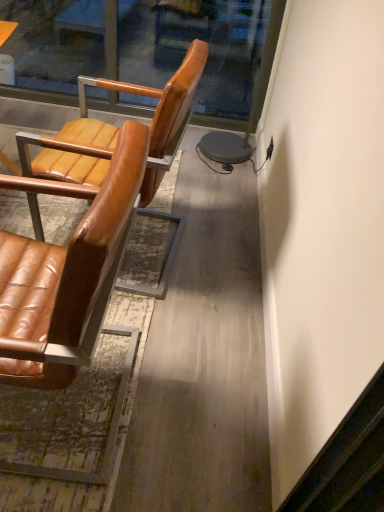
Question: Does brown leather chair at left, arranged as the 2th chair when viewed from the back, have a larger size compared to brown leather chair at left, which appears as the first chair when viewed from the back?

Choices:
 (A) no
 (B) yes

Answer: (B)

Question: Considering the relative sizes of brown leather chair at left, arranged as the 2th chair when viewed from the back, and brown leather chair at left, placed as the second chair when sorted from front to back, in the image provided, is brown leather chair at left, arranged as the 2th chair when viewed from the back, shorter than brown leather chair at left, placed as the second chair when sorted from front to back,?

Choices:
 (A) no
 (B) yes

Answer: (A)

Question: Could you tell me if brown leather chair at left, the 1th chair positioned from the front, is turned towards brown leather chair at left, placed as the second chair when sorted from front to back?

Choices:
 (A) no
 (B) yes

Answer: (A)

Question: Can you confirm if brown leather chair at left, arranged as the 2th chair when viewed from the back, is taller than brown leather chair at left, placed as the second chair when sorted from front to back?

Choices:
 (A) no
 (B) yes

Answer: (B)

Question: From the image's perspective, is brown leather chair at left, arranged as the 2th chair when viewed from the back, located above brown leather chair at left, which appears as the first chair when viewed from the back?

Choices:
 (A) no
 (B) yes

Answer: (A)

Question: Visually, is transparent glass door at upper center positioned to the left or to the right of brown leather chair at left, which appears as the first chair when viewed from the back?

Choices:
 (A) right
 (B) left

Answer: (B)

Question: Is point (122, 20) positioned closer to the camera than point (77, 154)?

Choices:
 (A) closer
 (B) farther

Answer: (B)

Question: From a real-world perspective, is transparent glass door at upper center positioned above or below brown leather chair at left, which appears as the first chair when viewed from the back?

Choices:
 (A) above
 (B) below

Answer: (B)

Question: In terms of size, does transparent glass door at upper center appear bigger or smaller than brown leather chair at left, placed as the second chair when sorted from front to back?

Choices:
 (A) small
 (B) big

Answer: (A)

Question: Do you think brown leather chair at left, arranged as the 2th chair when viewed from the back, is within brown leather chair at left, placed as the second chair when sorted from front to back, or outside of it?

Choices:
 (A) inside
 (B) outside

Answer: (B)

Question: In the image, is brown leather chair at left, arranged as the 2th chair when viewed from the back, positioned in front of or behind brown leather chair at left, which appears as the first chair when viewed from the back?

Choices:
 (A) behind
 (B) front

Answer: (B)

Question: From a real-world perspective, is brown leather chair at left, arranged as the 2th chair when viewed from the back, above or below brown leather chair at left, placed as the second chair when sorted from front to back?

Choices:
 (A) above
 (B) below

Answer: (A)

Question: Is point (18, 270) closer or farther from the camera than point (162, 97)?

Choices:
 (A) closer
 (B) farther

Answer: (A)

Question: From their relative heights in the image, would you say transparent glass door at upper center is taller or shorter than brown leather chair at left, the 1th chair positioned from the front?

Choices:
 (A) short
 (B) tall

Answer: (A)

Question: From a real-world perspective, is transparent glass door at upper center positioned above or below brown leather chair at left, arranged as the 2th chair when viewed from the back?

Choices:
 (A) above
 (B) below

Answer: (B)